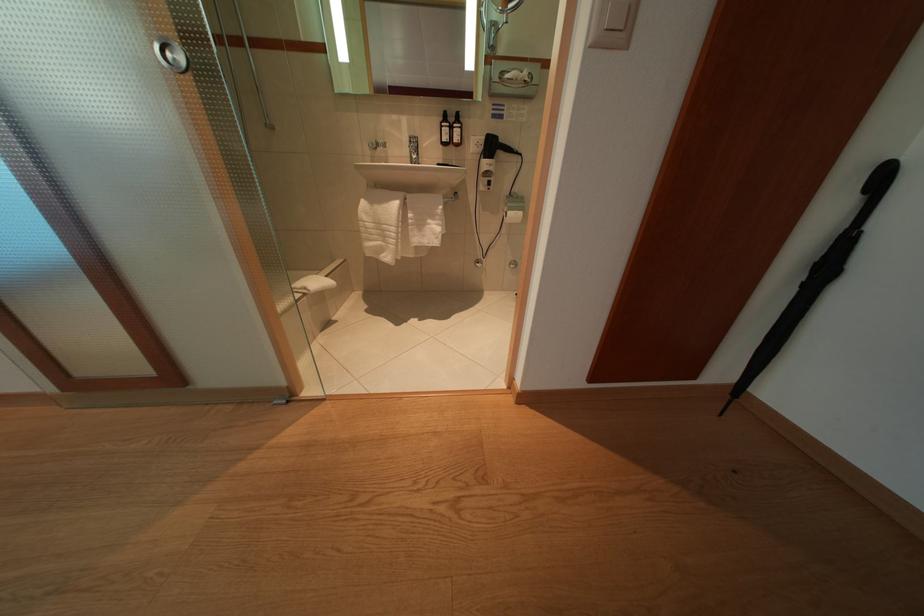
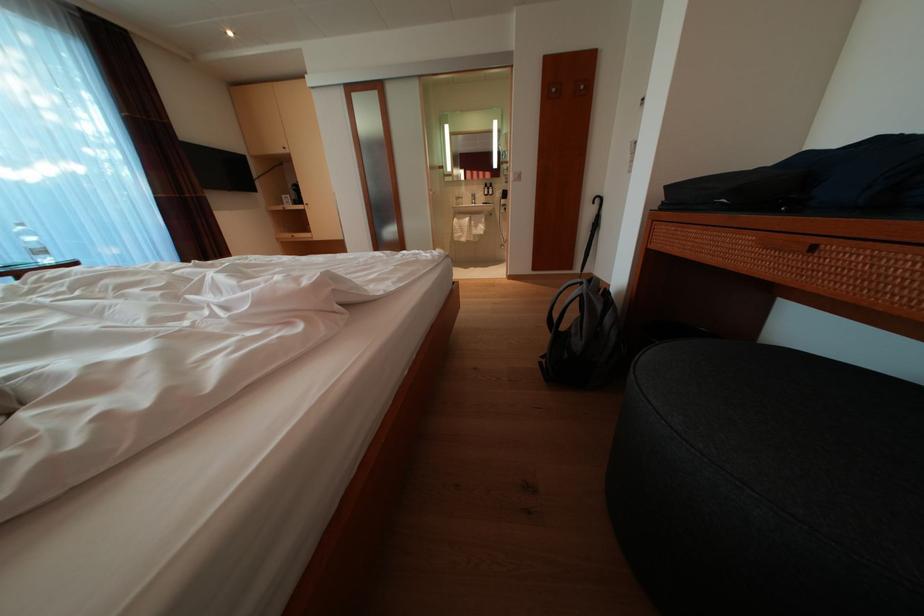
Locate, in the second image, the point that corresponds to pixel 404 209 in the first image.

(476, 225)